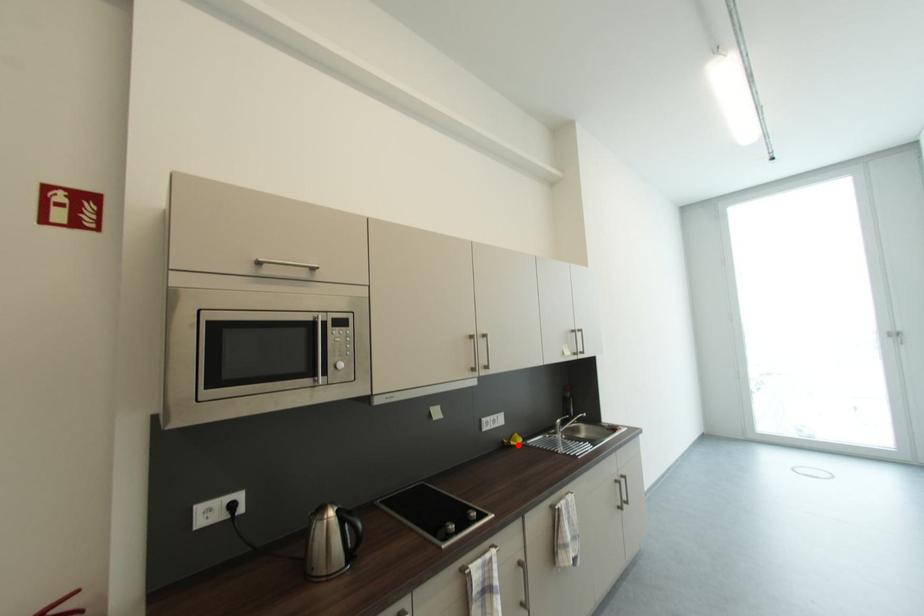
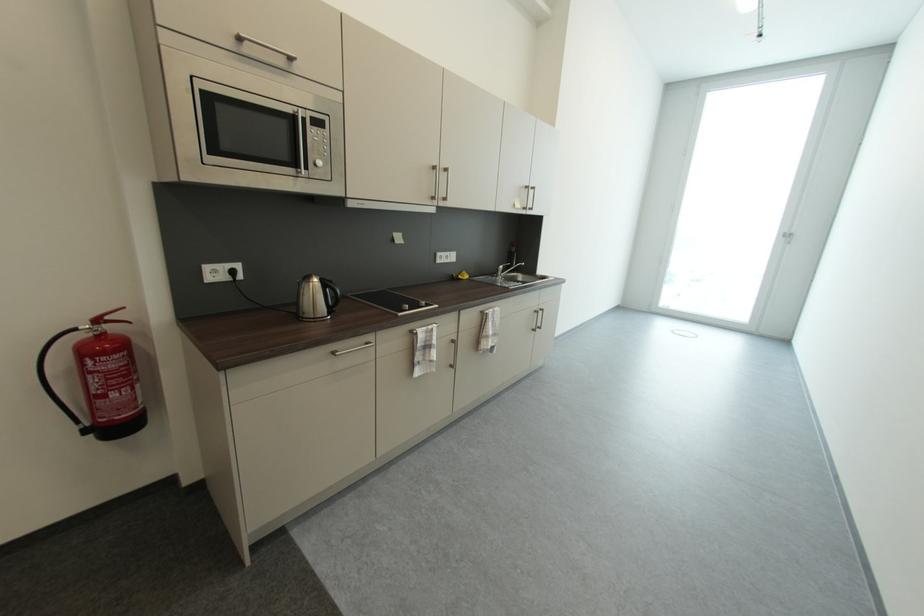
Question: I am providing you with two images of the same scene from different viewpoints. Image1 has a red point marked. In image2, the corresponding 3D location appears at what relative position? Reply with the corresponding letter.

Choices:
 (A) Closer
 (B) Farther

Answer: (A)